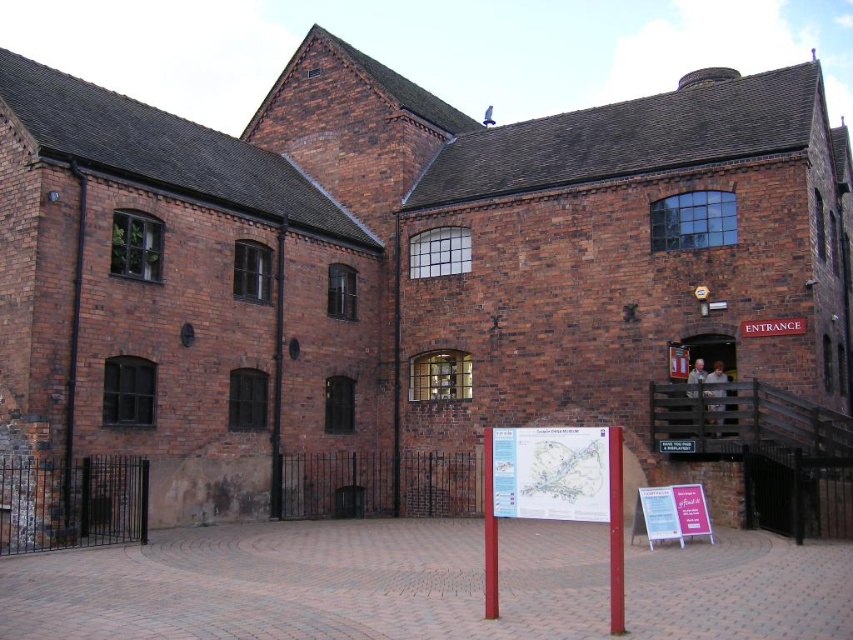
You are a tourist holding a compass and standing in front of the historic brick building. You see a light blue paper map at center and a pink paper sign at center. According to the compass, north is directly ahead of you. Which object is taller when facing the building?

The light blue paper map at center is taller than the pink paper sign at center.

You are a tourist holding a compass and looking at the light blue paper map at center and the pink paper sign at center in front of you. According to the compass, which object is more to the east?

The light blue paper map at center is wider than the pink paper sign at center, but the compass direction cannot be determined based on width. You need to check the actual position of the objects relative to the compass.